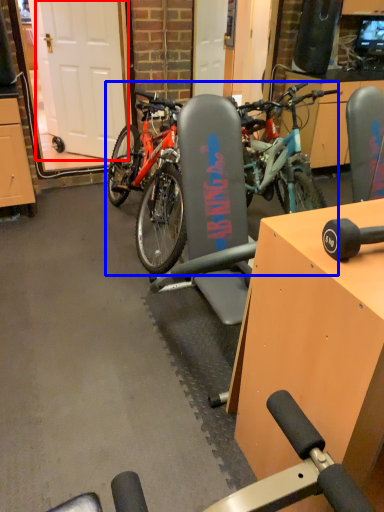
Question: Which point is further to the camera, garage door (highlighted by a red box) or bicycle (highlighted by a blue box)?

Choices:
 (A) garage door
 (B) bicycle

Answer: (A)